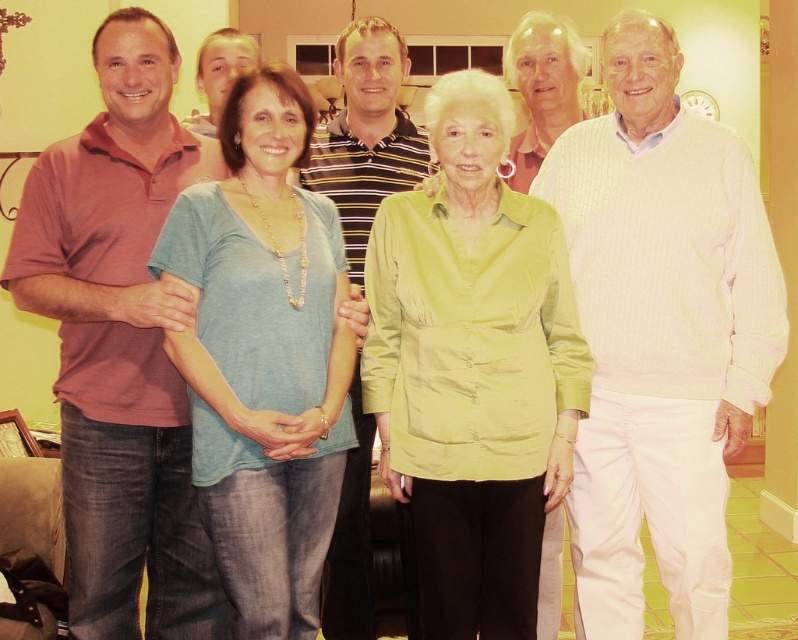
Based on the scene described, which of the two individuals wearing a matte red polo shirt at left and a striped polo shirt at center is positioned closer to the camera?

The matte red polo shirt at left is positioned closer to the camera since it is in front of the striped polo shirt at center.